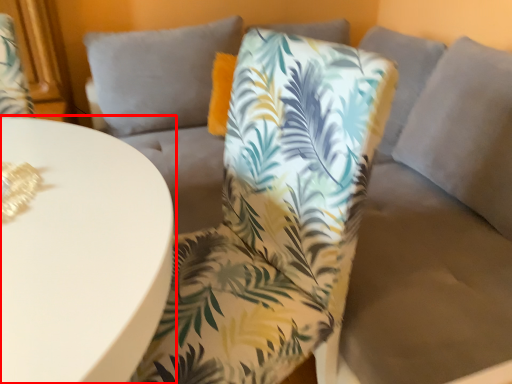
Question: From the image's perspective, considering the relative positions of table (annotated by the red box) and chair in the image provided, where is table (annotated by the red box) located with respect to the staircase?

Choices:
 (A) below
 (B) above

Answer: (A)